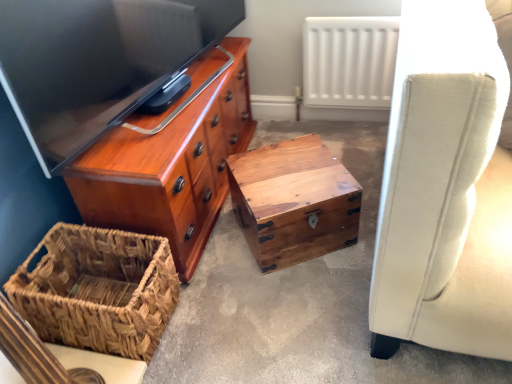
At what (x,y) coordinates should I click in order to perform the action: click on empty space that is ontop of natural wood trunk at center (from a real-world perspective). Please return your answer as a coordinate pair (x, y). This screenshot has height=384, width=512. Looking at the image, I should click on (290, 165).